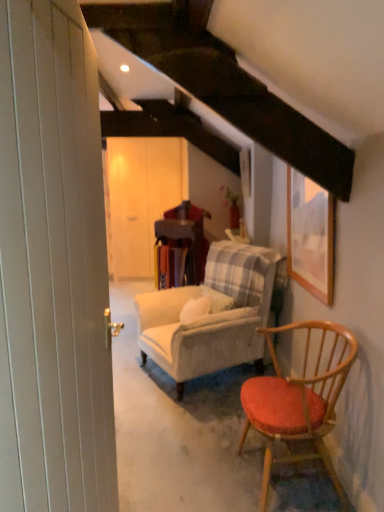
Question: In terms of size, does velvet beige armchair at center appear bigger or smaller than white wooden barn door at left, arranged as the 1th barn door when viewed from the front?

Choices:
 (A) big
 (B) small

Answer: (A)

Question: From a real-world perspective, relative to white wooden barn door at left, arranged as the 1th barn door when viewed from the front, is velvet beige armchair at center vertically above or below?

Choices:
 (A) below
 (B) above

Answer: (A)

Question: Which object is the farthest from the velvet beige armchair at center?

Choices:
 (A) white wood door at center, the first barn door from the back
 (B) wooden table at center
 (C) white wooden barn door at left, arranged as the 1th barn door when viewed from the front
 (D) wooden framed picture at upper right

Answer: (A)

Question: Based on their relative distances, which object is farther from the velvet beige armchair at center?

Choices:
 (A) white wooden barn door at left, arranged as the 1th barn door when viewed from the front
 (B) wooden framed picture at upper right
 (C) white wood door at center, the first barn door from the back
 (D) wooden table at center

Answer: (C)